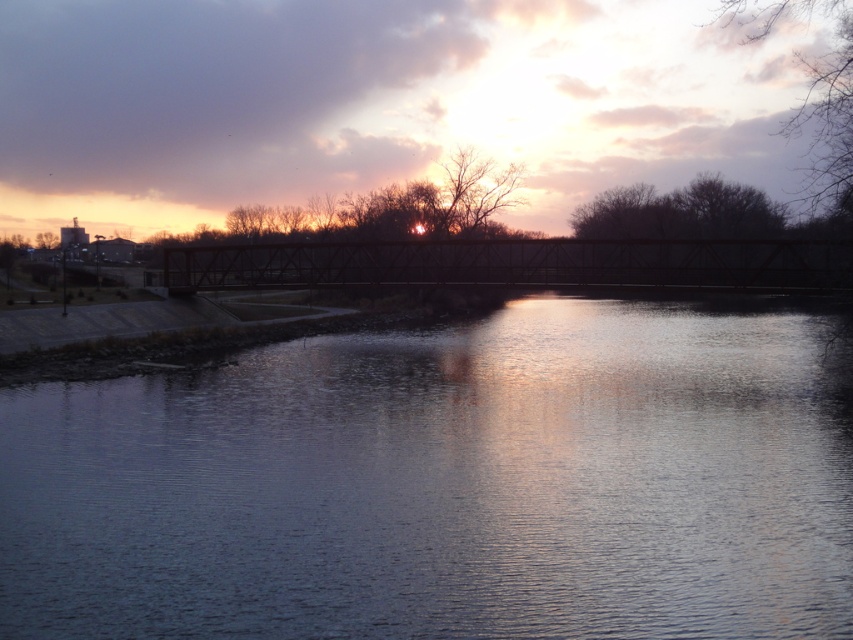
Which is more to the left, smooth water at center or dark brown metal bridge at center?

dark brown metal bridge at center is more to the left.

Who is lower down, smooth water at center or dark brown metal bridge at center?

smooth water at center is lower down.

What do you see at coordinates (448, 483) in the screenshot? I see `smooth water at center` at bounding box center [448, 483].

Image resolution: width=853 pixels, height=640 pixels. I want to click on smooth water at center, so click(x=448, y=483).